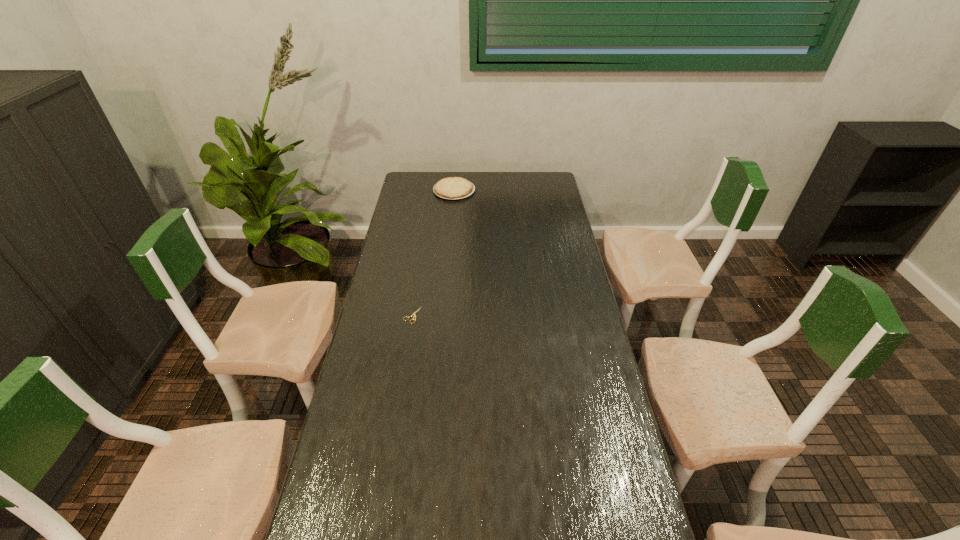
Where is `tortilla`? This screenshot has width=960, height=540. tortilla is located at coordinates [450, 187].

The height and width of the screenshot is (540, 960). What are the coordinates of `the farther object` in the screenshot? It's located at (450, 187).

This screenshot has height=540, width=960. Find the location of `the shorter object`. the shorter object is located at coordinates (414, 314).

I want to click on the nearer object, so click(x=414, y=314).

Identify the location of free space located 0.350m on the right of the tortilla. (544, 191).

This screenshot has width=960, height=540. Find the location of `free space located 0.240m on the back of the nearer object`. free space located 0.240m on the back of the nearer object is located at coordinates (420, 265).

In order to click on object at the far edge in this screenshot , I will do `click(450, 187)`.

The width and height of the screenshot is (960, 540). What are the coordinates of `tortilla at the left edge` in the screenshot? It's located at (450, 187).

What are the coordinates of `shears positioned at the left edge` in the screenshot? It's located at (414, 314).

Image resolution: width=960 pixels, height=540 pixels. In order to click on object that is positioned at the far left corner in this screenshot , I will do `click(450, 187)`.